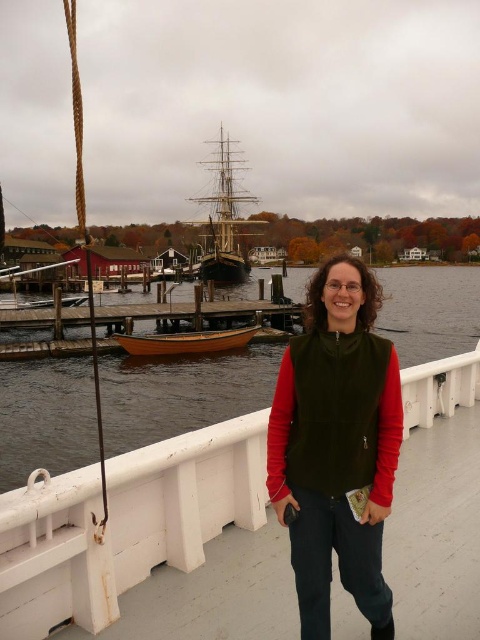
Is green fleece vest at center taller than wooden boat at center?

Yes, green fleece vest at center is taller than wooden boat at center.

Which is behind, point (372, 387) or point (154, 333)?

The point (154, 333) is behind.

Locate an element on the screen. green fleece vest at center is located at coordinates pyautogui.click(x=336, y=445).

At what (x,y) coordinates should I click in order to perform the action: click on green fleece vest at center. Please return your answer as a coordinate pair (x, y). This screenshot has height=640, width=480. Looking at the image, I should click on (336, 445).

Which is in front, point (2, 592) or point (197, 221)?

Point (2, 592) is in front.

Is white wooden deck at center in front of wooden ship at center?

That is True.

Between point (72, 584) and point (223, 253), which one is positioned in front?

Positioned in front is point (72, 584).

Identify the location of white wooden deck at center. (124, 524).

Based on the photo, can you confirm if green fleece vest at center is wider than clear water at lower center?

No.

Does green fleece vest at center appear on the right side of clear water at lower center?

No, green fleece vest at center is not to the right of clear water at lower center.

Is point (362, 330) more distant than point (212, 401)?

No, (362, 330) is in front of (212, 401).

You are a GUI agent. You are given a task and a screenshot of the screen. Output one action in this format:
    pyautogui.click(x=<x>, y=<y>)
    Task: Click on the green fleece vest at center
    This screenshot has height=640, width=480.
    Given the screenshot: What is the action you would take?
    pyautogui.click(x=336, y=445)